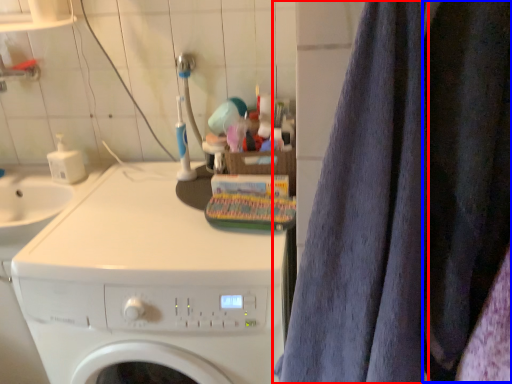
Question: Which of the following is the closest to the observer, bath towel (highlighted by a red box) or clothing (highlighted by a blue box)?

Choices:
 (A) bath towel
 (B) clothing

Answer: (A)